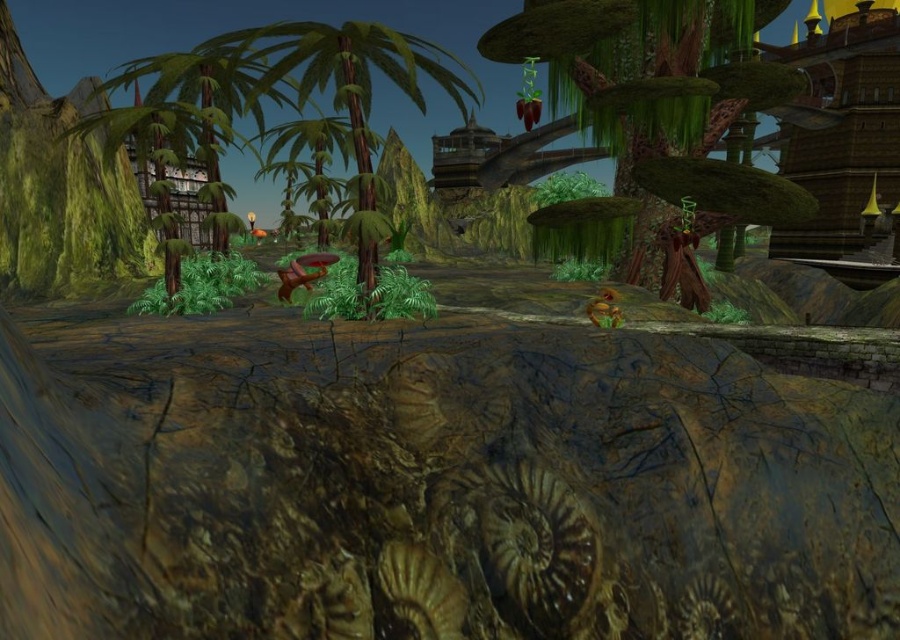
Can you confirm if green mossy tree at center is wider than green matte palm tree at center?

No, green mossy tree at center is not wider than green matte palm tree at center.

Is point (681, 22) farther from viewer compared to point (284, 32)?

Yes.

You are a GUI agent. You are given a task and a screenshot of the screen. Output one action in this format:
    pyautogui.click(x=<x>, y=<y>)
    Task: Click on the green mossy tree at center
    The image size is (900, 640).
    Given the screenshot: What is the action you would take?
    pyautogui.click(x=662, y=113)